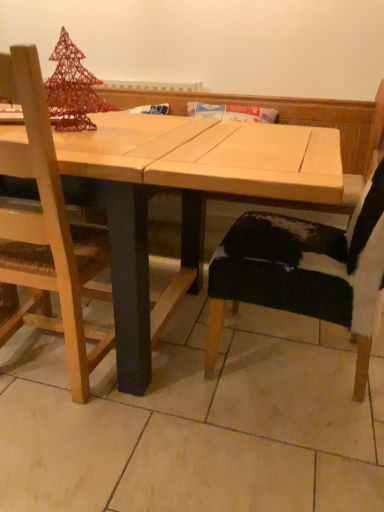
Question: Does wooden chair at left, positioned as the 2th chair in right-to-left order, have a lesser width compared to natural wood table at center?

Choices:
 (A) no
 (B) yes

Answer: (B)

Question: Considering the relative sizes of wooden chair at left, marked as the 1th chair in a left-to-right arrangement, and natural wood table at center in the image provided, is wooden chair at left, marked as the 1th chair in a left-to-right arrangement, shorter than natural wood table at center?

Choices:
 (A) no
 (B) yes

Answer: (A)

Question: Is wooden chair at left, marked as the 1th chair in a left-to-right arrangement, smaller than natural wood table at center?

Choices:
 (A) yes
 (B) no

Answer: (A)

Question: From a real-world perspective, is wooden chair at left, positioned as the 2th chair in right-to-left order, on natural wood table at center?

Choices:
 (A) yes
 (B) no

Answer: (A)

Question: Is wooden chair at left, marked as the 1th chair in a left-to-right arrangement, wider than natural wood table at center?

Choices:
 (A) yes
 (B) no

Answer: (B)

Question: Is point (208, 154) positioned closer to the camera than point (46, 121)?

Choices:
 (A) farther
 (B) closer

Answer: (A)

Question: In the image, is natural wood table at center on the left side or the right side of wooden chair at left, positioned as the 2th chair in right-to-left order?

Choices:
 (A) right
 (B) left

Answer: (A)

Question: From the image's perspective, is natural wood table at center above or below wooden chair at left, positioned as the 2th chair in right-to-left order?

Choices:
 (A) above
 (B) below

Answer: (A)

Question: From a real-world perspective, is natural wood table at center above or below wooden chair at left, marked as the 1th chair in a left-to-right arrangement?

Choices:
 (A) above
 (B) below

Answer: (B)

Question: Is wooden chair at left, marked as the 1th chair in a left-to-right arrangement, taller or shorter than cowhide black chair at lower right, acting as the first chair starting from the right?

Choices:
 (A) tall
 (B) short

Answer: (B)

Question: Considering the positions of wooden chair at left, marked as the 1th chair in a left-to-right arrangement, and cowhide black chair at lower right, arranged as the 2th chair when viewed from the left, in the image, is wooden chair at left, marked as the 1th chair in a left-to-right arrangement, wider or thinner than cowhide black chair at lower right, arranged as the 2th chair when viewed from the left,?

Choices:
 (A) thin
 (B) wide

Answer: (A)

Question: From a real-world perspective, is wooden chair at left, marked as the 1th chair in a left-to-right arrangement, positioned above or below cowhide black chair at lower right, arranged as the 2th chair when viewed from the left?

Choices:
 (A) above
 (B) below

Answer: (B)

Question: Is wooden chair at left, marked as the 1th chair in a left-to-right arrangement, situated inside cowhide black chair at lower right, acting as the first chair starting from the right, or outside?

Choices:
 (A) outside
 (B) inside

Answer: (A)

Question: Is point (18, 212) closer or farther from the camera than point (94, 167)?

Choices:
 (A) closer
 (B) farther

Answer: (B)

Question: Considering the relative positions of wooden chair at left, positioned as the 2th chair in right-to-left order, and natural wood table at center in the image provided, is wooden chair at left, positioned as the 2th chair in right-to-left order, to the left or to the right of natural wood table at center?

Choices:
 (A) left
 (B) right

Answer: (A)